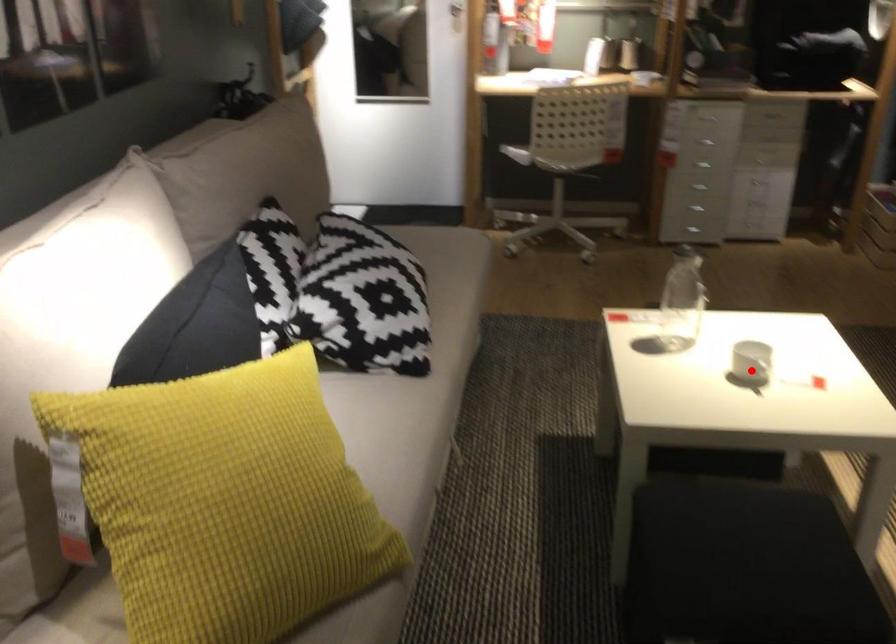
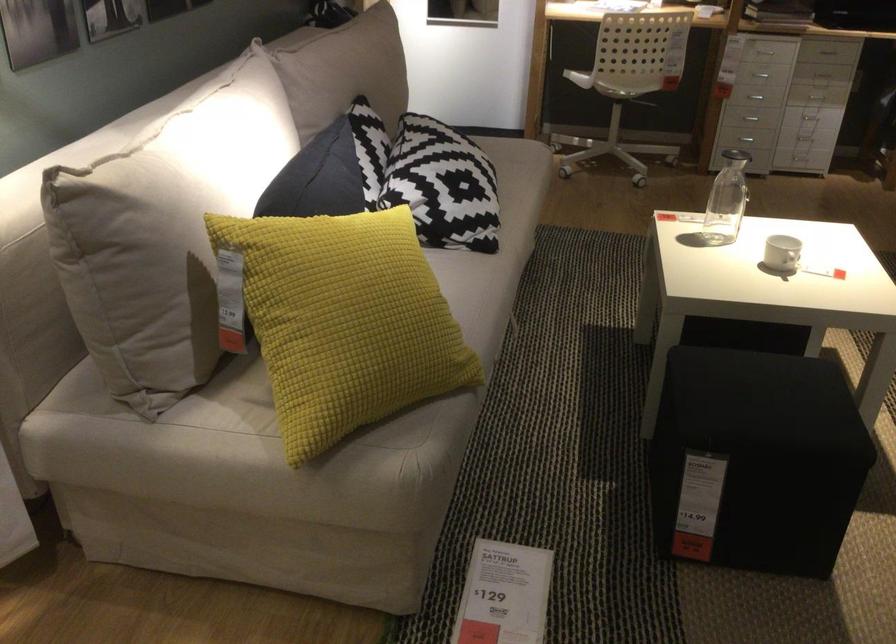
Question: I am providing you with two images of the same scene from different viewpoints. A red point is shown in image1. For the corresponding object point in image2, is it positioned nearer or farther from the camera?

Choices:
 (A) Nearer
 (B) Farther

Answer: (B)